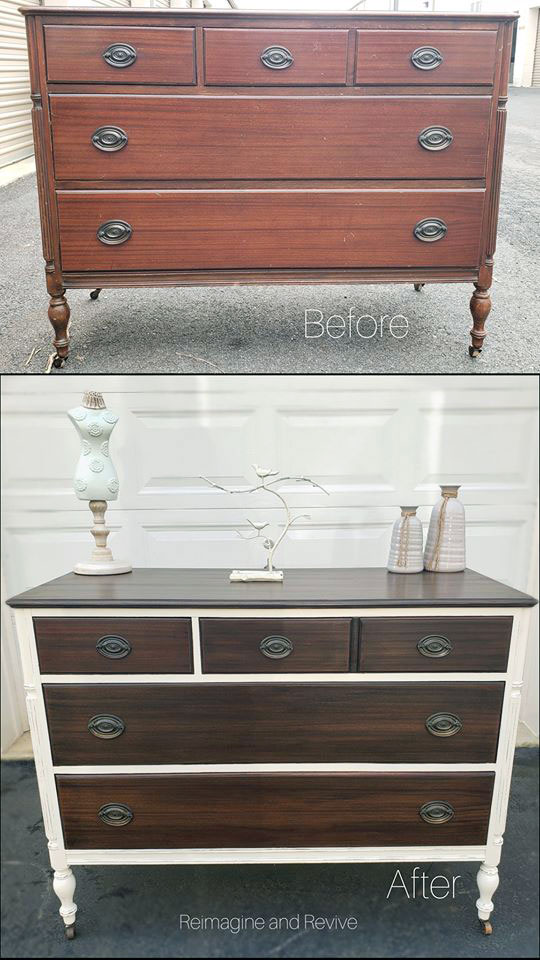
Identify the location of before top drawers. The width and height of the screenshot is (540, 960). (141, 59), (285, 64), (390, 54).